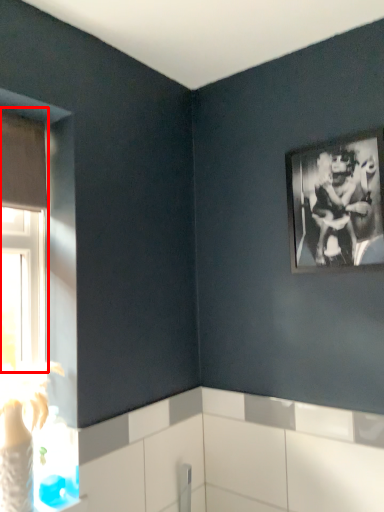
Question: Considering the relative positions of window (annotated by the red box) and picture frame in the image provided, where is window (annotated by the red box) located with respect to the staircase?

Choices:
 (A) left
 (B) right

Answer: (A)